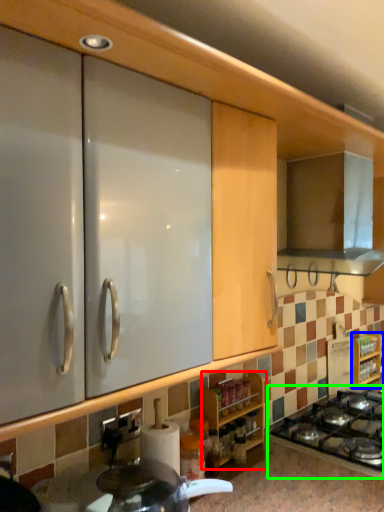
Question: Which is farther away from cabinetry (highlighted by a red box)? cabinetry (highlighted by a blue box) or gas stove (highlighted by a green box)?

Choices:
 (A) cabinetry
 (B) gas stove

Answer: (A)